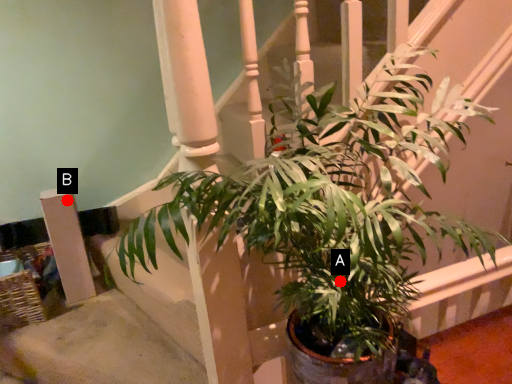
Question: Two points are circled on the image, labeled by A and B beside each circle. Which of the following is the farthest from the observer?

Choices:
 (A) A is further
 (B) B is further

Answer: (B)